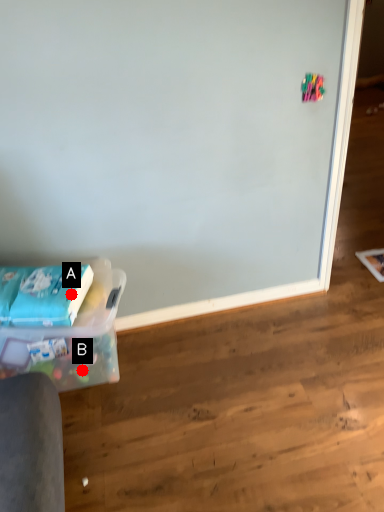
Question: Two points are circled on the image, labeled by A and B beside each circle. Which point is farther from the camera taking this photo?

Choices:
 (A) A is further
 (B) B is further

Answer: (B)